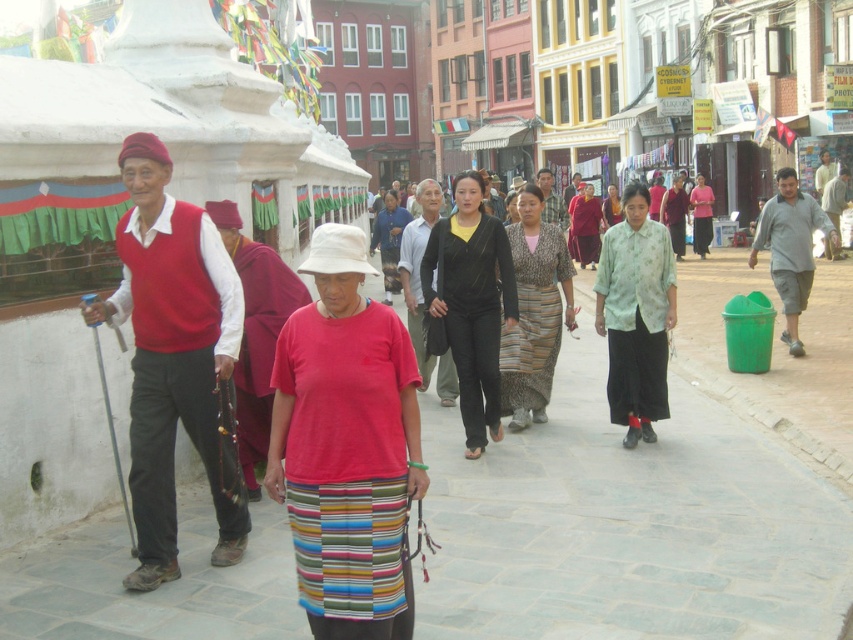
At what (x,y) coordinates should I click in order to perform the action: click on maroon velvet robe at center. Please return your answer as a coordinate pair (x, y). Image resolution: width=853 pixels, height=640 pixels. Looking at the image, I should click on (254, 332).

Who is taller, maroon velvet robe at center or floral silk blouse at center?

With more height is maroon velvet robe at center.

Find the location of a particular element. maroon velvet robe at center is located at coordinates (254, 332).

The image size is (853, 640). Find the location of `maroon velvet robe at center`. maroon velvet robe at center is located at coordinates pos(254,332).

Between gray stone pavement at center and black silk dress at center, which one appears on the right side from the viewer's perspective?

From the viewer's perspective, gray stone pavement at center appears more on the right side.

Does point (581, 605) lie behind point (387, 244)?

No, (581, 605) is in front of (387, 244).

The image size is (853, 640). I want to click on gray stone pavement at center, so click(x=630, y=524).

Locate an element on the screen. The image size is (853, 640). gray stone pavement at center is located at coordinates (630, 524).

Which is behind, point (328, 388) or point (822, 168)?

Point (822, 168)

Between red cotton shirt at center and light brown textured shirt at right, which one is positioned lower?

red cotton shirt at center

Where is `red cotton shirt at center`? This screenshot has height=640, width=853. red cotton shirt at center is located at coordinates (346, 445).